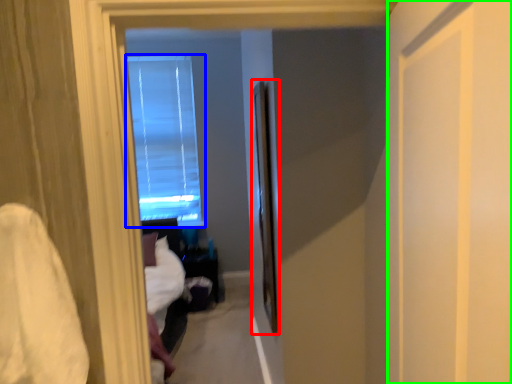
Question: Considering the real-world distances, which object is closest to screen door (highlighted by a red box)? window (highlighted by a blue box) or screen door (highlighted by a green box).

Choices:
 (A) window
 (B) screen door

Answer: (B)